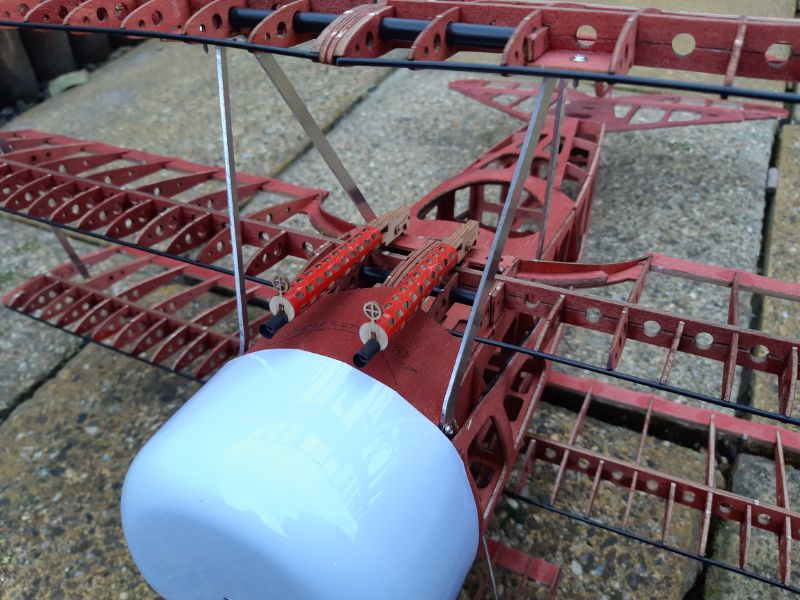
In order to click on blueish black metal beam in this screenshot , I will do `click(486, 33)`.